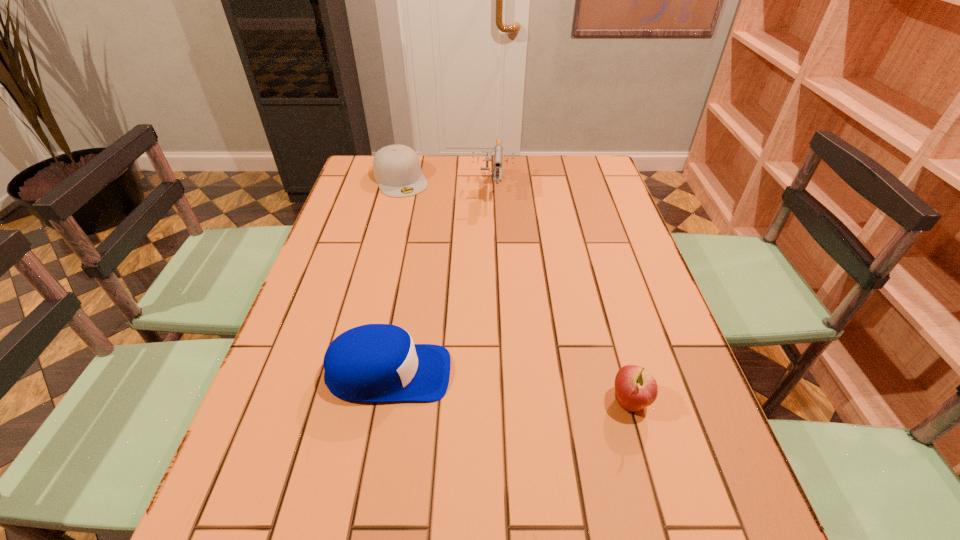
Locate an element on the screen. vacant area that satisfies the following two spatial constraints: 1. on the front side of the cap; 2. on the front-facing side of the baseball cap is located at coordinates (352, 374).